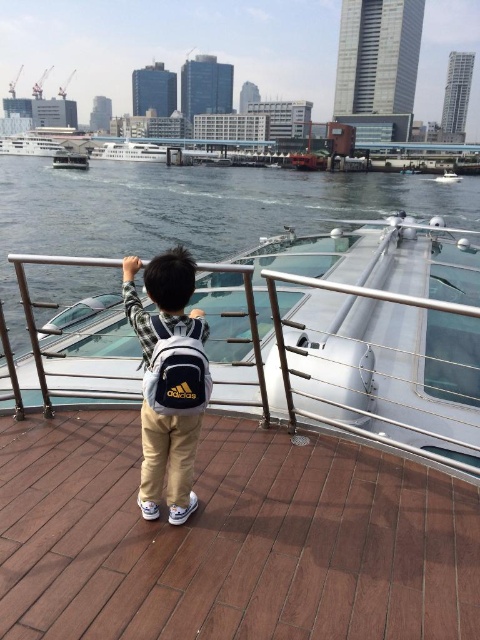
Question: Which object appears closest to the camera in this image?

Choices:
 (A) brown wooden deck at center
 (B) metallic gray boat at upper center

Answer: (A)

Question: Which object is closer to the camera taking this photo?

Choices:
 (A) clear water at center
 (B) khaki cotton pants at center
 (C) brown wooden deck at center
 (D) white glossy boat at center

Answer: (C)

Question: Which point is farther to the camera?

Choices:
 (A) clear water at center
 (B) brown wooden deck at center
 (C) khaki cotton pants at center
 (D) metallic gray boat at upper center

Answer: (D)

Question: In this image, where is white glossy boat at center located relative to metallic gray boat at upper center?

Choices:
 (A) right
 (B) left

Answer: (A)

Question: Does khaki cotton pants at center appear under white glossy boat at upper left?

Choices:
 (A) yes
 (B) no

Answer: (A)

Question: Is brown wooden deck at center below white glossy boat at center?

Choices:
 (A) yes
 (B) no

Answer: (A)